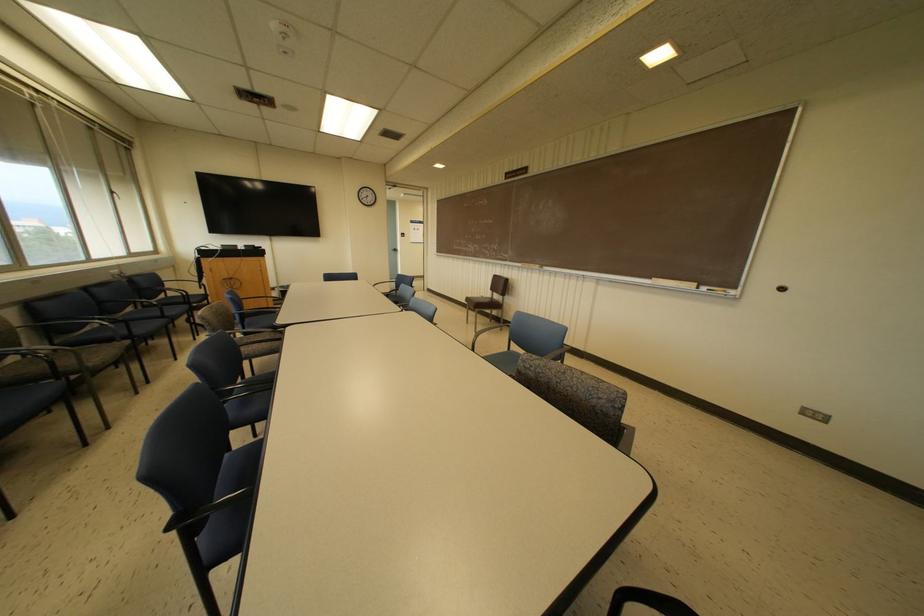
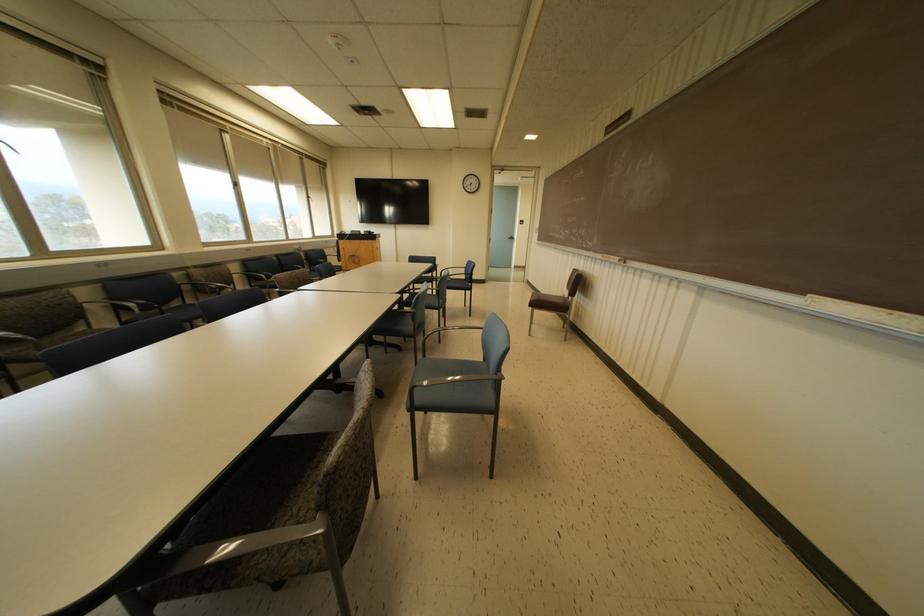
Question: I am providing you with two images of the same scene from different viewpoints. Which of the following objects are not visible in image2?

Choices:
 (A) blue chair sitting surface
 (B) chalkboard eraser
 (C) dark blue chair armrest
 (D) none of these

Answer: (D)